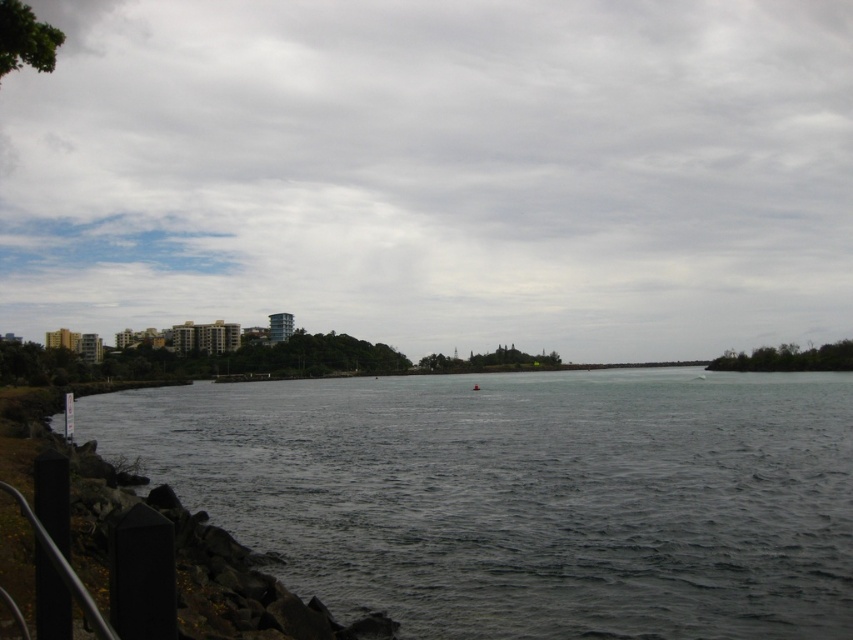
You are a photographer planning to capture the waterfront scene. You want to ensure that the gray cloudy sky at upper center and the dark gray water at center are both visible in your shot. Based on their positions, which object will appear to the left in the photo?

The gray cloudy sky at upper center is positioned on the left side of dark gray water at center, so the gray cloudy sky at upper center will appear to the left in the photo.

You are an artist planning to paint the waterfront scene. You want to ensure the gray cloudy sky at upper center and the dark gray water at center are proportionally accurate. Based on their widths, which one should you make wider in your painting?

The gray cloudy sky at upper center might be wider than dark gray water at center, so you should paint the gray cloudy sky at upper center wider than the dark gray water at center to maintain proportion.

Consider the image. You are standing at the shoreline looking out at the water. There are two points marked on the image. Which of the two points, point (640, 358) or point (840, 374), is closer to you?

Point (640, 358) is closer to you because it is further to the viewer than point (840, 374).